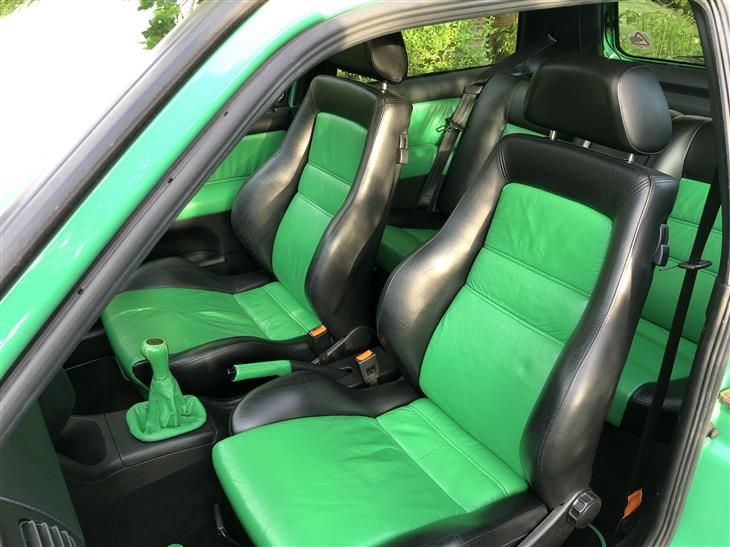
Image resolution: width=730 pixels, height=547 pixels. In order to click on seat 2 in this screenshot , I will do `click(307, 298)`.